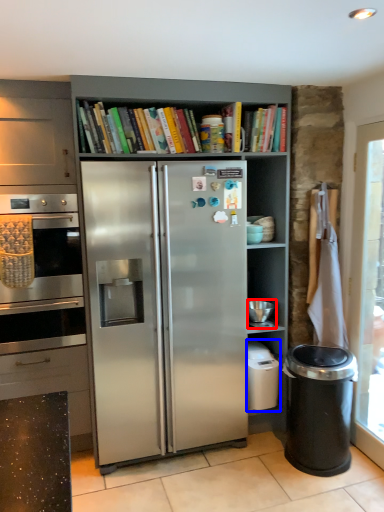
Question: Which object is closer to the camera taking this photo, appliance (highlighted by a red box) or dish washer (highlighted by a blue box)?

Choices:
 (A) appliance
 (B) dish washer

Answer: (A)